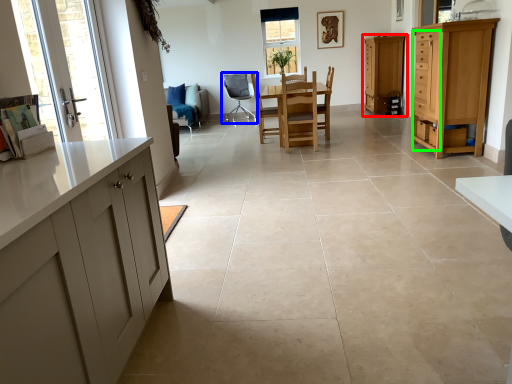
Question: Considering the real-world distances, which object is closest to cabinetry (highlighted by a red box)? chair (highlighted by a blue box) or drawer (highlighted by a green box).

Choices:
 (A) chair
 (B) drawer

Answer: (A)